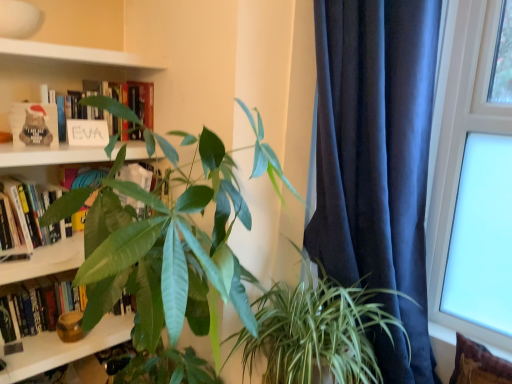
What is the approximate height of hardcover book at left, acting as the third book starting from the top?

The height of hardcover book at left, acting as the third book starting from the top, is 29.59 centimeters.

This screenshot has width=512, height=384. Describe the element at coordinates (478, 364) in the screenshot. I see `brown textured pillow at lower right` at that location.

This screenshot has height=384, width=512. Identify the location of green leafy plant at center, which is the 2th houseplant from left to right. (317, 331).

I want to click on hardcover book at upper left, the second book ordered from the bottom, so click(37, 212).

Describe the element at coordinates (37, 212) in the screenshot. Image resolution: width=512 pixels, height=384 pixels. I see `hardcover book at upper left, which is the 2th book in top-to-bottom order` at that location.

I want to click on transparent glass window at upper right, so click(x=471, y=178).

From a real-world perspective, is hardcover book at left, acting as the third book starting from the top, positioned above or below green leafy plant at center, which is the 2th houseplant from left to right?

From a real-world perspective, hardcover book at left, acting as the third book starting from the top, is physically below green leafy plant at center, which is the 2th houseplant from left to right.

Considering the positions of objects hardcover book at left, acting as the third book starting from the top, and green leafy plant at center, which is the 2th houseplant from left to right, in the image provided, who is more to the left, hardcover book at left, acting as the third book starting from the top, or green leafy plant at center, which is the 2th houseplant from left to right,?

hardcover book at left, acting as the third book starting from the top, is more to the left.

In terms of size, does hardcover book at left, acting as the third book starting from the top, appear bigger or smaller than green leafy plant at center, which is the 2th houseplant from left to right?

Clearly, hardcover book at left, acting as the third book starting from the top, is smaller in size than green leafy plant at center, which is the 2th houseplant from left to right.

Considering the sizes of hardcover book at left, the 1th book ordered from the bottom, and green leafy plant at center, the 1th houseplant when ordered from right to left, in the image, is hardcover book at left, the 1th book ordered from the bottom, taller or shorter than green leafy plant at center, the 1th houseplant when ordered from right to left,?

In the image, hardcover book at left, the 1th book ordered from the bottom, appears to be shorter than green leafy plant at center, the 1th houseplant when ordered from right to left.

From a real-world perspective, is green leafy plant at center, which is the 2th houseplant from left to right, located beneath hardcover book at upper left, the second book ordered from the bottom?

Correct, in the physical world, green leafy plant at center, which is the 2th houseplant from left to right, is lower than hardcover book at upper left, the second book ordered from the bottom.

Measure the distance between green leafy plant at center, which is the 2th houseplant from left to right, and hardcover book at upper left, the second book ordered from the bottom.

green leafy plant at center, which is the 2th houseplant from left to right, is 29.97 inches away from hardcover book at upper left, the second book ordered from the bottom.

Would you say green leafy plant at center, which is the 2th houseplant from left to right, is inside or outside hardcover book at upper left, the second book ordered from the bottom?

The correct answer is: outside.

Measure the distance between dark blue velvet curtain at right and transparent glass window at upper right.

dark blue velvet curtain at right and transparent glass window at upper right are 14.25 inches apart.

Between dark blue velvet curtain at right and transparent glass window at upper right, which one has smaller size?

transparent glass window at upper right is smaller.

From the image's perspective, is dark blue velvet curtain at right under transparent glass window at upper right?

Indeed, from the image's perspective, dark blue velvet curtain at right is shown beneath transparent glass window at upper right.

How different are the orientations of dark blue velvet curtain at right and transparent glass window at upper right in degrees?

They differ by 64.2 degrees in their facing directions.

Is white matte sign at upper left, which is the 1th book in top-to-bottom order, oriented towards transparent glass window at upper right?

No, white matte sign at upper left, which is the 1th book in top-to-bottom order, is not facing towards transparent glass window at upper right.

I want to click on book that is above the transparent glass window at upper right (from the image's perspective), so click(x=116, y=100).

Is white matte sign at upper left, the third book ordered from the bottom, to the left or to the right of transparent glass window at upper right in the image?

white matte sign at upper left, the third book ordered from the bottom, is positioned on transparent glass window at upper right's left side.

Does point (320, 179) come behind point (297, 318)?

Yes, point (320, 179) is farther from viewer.

Which object is closer to the camera taking this photo, dark blue velvet curtain at right or green leafy plant at center, which is the 2th houseplant from left to right?

dark blue velvet curtain at right.

From the image's perspective, is dark blue velvet curtain at right on green leafy plant at center, the 1th houseplant when ordered from right to left?

Yes.

Would you say dark blue velvet curtain at right is a long distance from green leafy plant at center, the 1th houseplant when ordered from right to left?

No, dark blue velvet curtain at right is in close proximity to green leafy plant at center, the 1th houseplant when ordered from right to left.

From the image's perspective, would you say brown textured pillow at lower right is shown under transparent glass window at upper right?

Correct, brown textured pillow at lower right appears lower than transparent glass window at upper right in the image.

Who is bigger, brown textured pillow at lower right or transparent glass window at upper right?

transparent glass window at upper right is bigger.

Consider the image. Considering the relative positions of brown textured pillow at lower right and transparent glass window at upper right in the image provided, is brown textured pillow at lower right to the left or to the right of transparent glass window at upper right?

brown textured pillow at lower right is positioned on transparent glass window at upper right's left side.

Is hardcover book at left, acting as the third book starting from the top, inside or outside of white matte sign at upper left, which is the 1th book in top-to-bottom order?

hardcover book at left, acting as the third book starting from the top, lies outside white matte sign at upper left, which is the 1th book in top-to-bottom order.

Based on the photo, from a real-world perspective, is hardcover book at left, the 1th book ordered from the bottom, positioned over white matte sign at upper left, the third book ordered from the bottom, based on gravity?

No, from a real-world perspective, hardcover book at left, the 1th book ordered from the bottom, is not on top of white matte sign at upper left, the third book ordered from the bottom.

The width and height of the screenshot is (512, 384). In order to click on book that appears on the right of hardcover book at left, the 1th book ordered from the bottom in this screenshot , I will do `click(116, 100)`.

In the scene shown: Between hardcover book at left, the 1th book ordered from the bottom, and white matte sign at upper left, the third book ordered from the bottom, which one has larger width?

With larger width is hardcover book at left, the 1th book ordered from the bottom.

Identify the location of the 1st houseplant in front of the hardcover book at left, the 1th book ordered from the bottom. The image size is (512, 384). (317, 331).

From a real-world perspective, starting from the green leafy plant at center, which is the 2th houseplant from left to right, which book is the 1st one vertically above it? Please provide its 2D coordinates.

[(37, 212)]

Estimate the real-world distances between objects in this image. Which object is further from green leafy plant at center, which is the 2th houseplant from left to right, hardcover book at upper left, which is the 2th book in top-to-bottom order, or dark blue velvet curtain at right?

hardcover book at upper left, which is the 2th book in top-to-bottom order, lies further to green leafy plant at center, which is the 2th houseplant from left to right, than the other object.

Estimate the real-world distances between objects in this image. Which object is further from green leafy plant at center, the 1th houseplant in the left-to-right sequence, hardcover book at upper left, the second book ordered from the bottom, or transparent glass window at upper right?

transparent glass window at upper right is positioned further to the anchor green leafy plant at center, the 1th houseplant in the left-to-right sequence.

Considering their positions, is green leafy plant at center, the 1th houseplant in the left-to-right sequence, positioned closer to brown textured pillow at lower right than transparent glass window at upper right?

Based on the image, transparent glass window at upper right appears to be nearer to brown textured pillow at lower right.

Looking at the image, which one is located further to brown textured pillow at lower right, transparent glass window at upper right or dark blue velvet curtain at right?

dark blue velvet curtain at right is further to brown textured pillow at lower right.

When comparing their distances from hardcover book at upper left, the second book ordered from the bottom, does brown textured pillow at lower right or green leafy plant at center, the 1th houseplant when ordered from right to left, seem further?

Based on the image, brown textured pillow at lower right appears to be further to hardcover book at upper left, the second book ordered from the bottom.

Looking at the image, which one is located further to green leafy plant at center, the 1th houseplant in the left-to-right sequence, white matte sign at upper left, which is the 1th book in top-to-bottom order, or hardcover book at left, acting as the third book starting from the top?

hardcover book at left, acting as the third book starting from the top, is positioned further to the anchor green leafy plant at center, the 1th houseplant in the left-to-right sequence.

Which object lies further to the anchor point green leafy plant at center, which is the 2th houseplant from left to right, brown textured pillow at lower right or dark blue velvet curtain at right?

Based on the image, brown textured pillow at lower right appears to be further to green leafy plant at center, which is the 2th houseplant from left to right.

Looking at the image, which one is located closer to hardcover book at left, acting as the third book starting from the top, hardcover book at upper left, the second book ordered from the bottom, or dark blue velvet curtain at right?

hardcover book at upper left, the second book ordered from the bottom, is closer to hardcover book at left, acting as the third book starting from the top.

Locate an element on the screen. curtain between hardcover book at left, the 1th book ordered from the bottom, and transparent glass window at upper right from left to right is located at coordinates (377, 163).

Find the location of `pillow between green leafy plant at center, the 1th houseplant when ordered from right to left, and transparent glass window at upper right, in the horizontal direction`. pillow between green leafy plant at center, the 1th houseplant when ordered from right to left, and transparent glass window at upper right, in the horizontal direction is located at coordinates (478, 364).

The width and height of the screenshot is (512, 384). In order to click on pillow between green leafy plant at center, placed as the second houseplant when sorted from right to left, and transparent glass window at upper right, in the horizontal direction in this screenshot , I will do `click(478, 364)`.

Image resolution: width=512 pixels, height=384 pixels. Identify the location of book between white matte sign at upper left, which is the 1th book in top-to-bottom order, and hardcover book at left, acting as the third book starting from the top, from top to bottom. (37, 212).